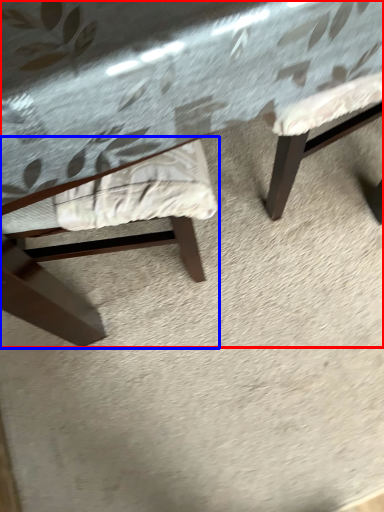
Question: Which object is further to the camera taking this photo, table (highlighted by a red box) or chair (highlighted by a blue box)?

Choices:
 (A) table
 (B) chair

Answer: (B)